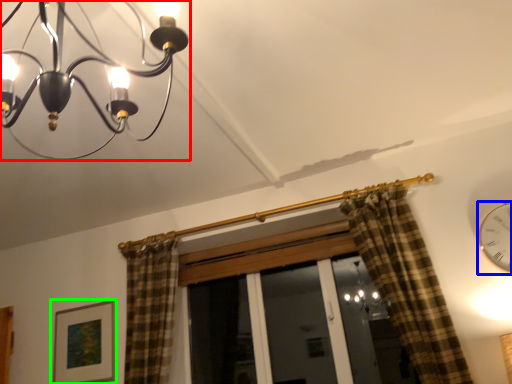
Question: Which object is positioned farthest from lamp (highlighted by a red box)? Select from clock (highlighted by a blue box) and picture frame (highlighted by a green box).

Choices:
 (A) clock
 (B) picture frame

Answer: (A)